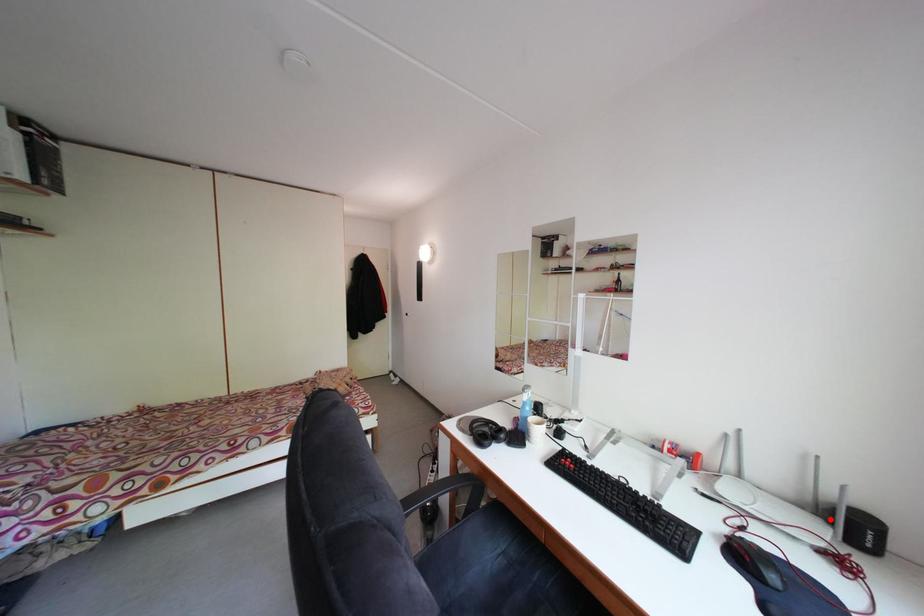
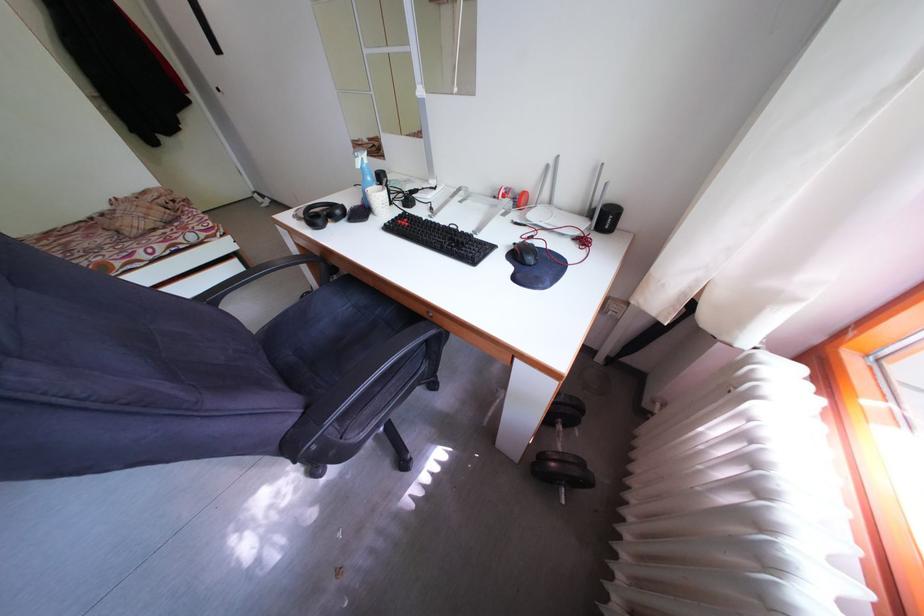
Where in the second image is the point corresponding to the highlighted location from the first image?

(599, 220)